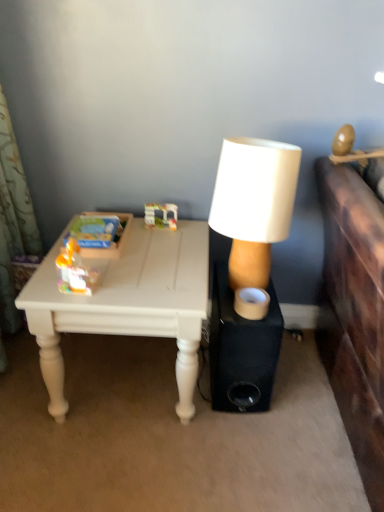
Question: Would you say translucent plastic toy at center, which is the first toy in back-to-front order, is inside or outside matte plastic toy at left, marked as the 2th toy in a top-to-bottom arrangement?

Choices:
 (A) outside
 (B) inside

Answer: (A)

Question: From the image's perspective, is translucent plastic toy at center, arranged as the 1th toy when viewed from the top, positioned above or below matte plastic toy at left, which appears as the second toy when viewed from the right?

Choices:
 (A) below
 (B) above

Answer: (B)

Question: Estimate the real-world distances between objects in this image. Which object is farther from the black matte speaker at center?

Choices:
 (A) white painted wood table at lower left
 (B) white matte lamp at center
 (C) matte plastic toy at left, which appears as the second toy when viewed from the right
 (D) translucent plastic toy at center, marked as the 2th toy in a front-to-back arrangement

Answer: (D)

Question: Which object is the farthest from the translucent plastic toy at center, the 2th toy when ordered from left to right?

Choices:
 (A) white painted wood table at lower left
 (B) white matte lamp at center
 (C) black matte speaker at center
 (D) matte plastic toy at left, the first toy in the left-to-right sequence

Answer: (C)